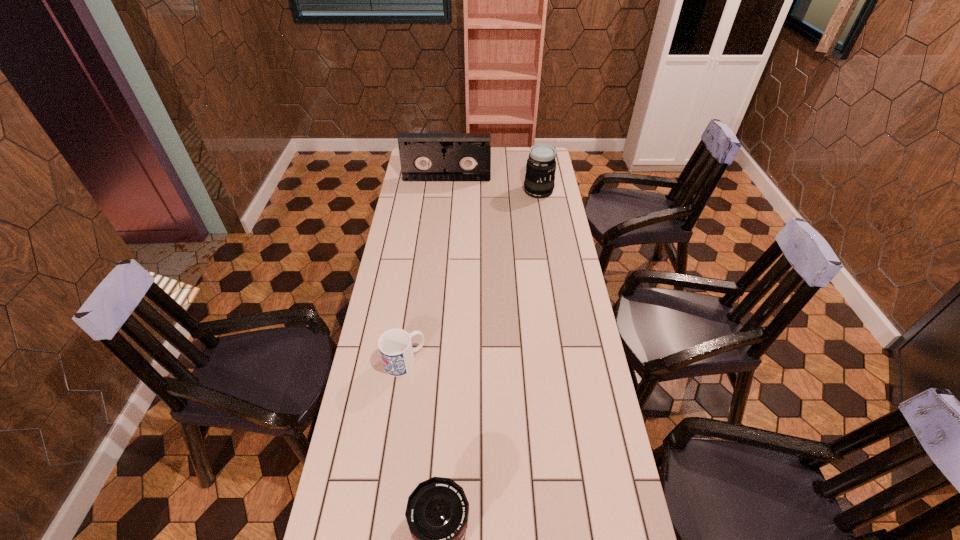
You are a GUI agent. You are given a task and a screenshot of the screen. Output one action in this format:
    pyautogui.click(x=<x>, y=<y>)
    Task: Click on the farthest object
    
    Given the screenshot: What is the action you would take?
    pyautogui.click(x=423, y=156)

At what (x,y) coordinates should I click in order to perform the action: click on the third nearest object. Please return your answer as a coordinate pair (x, y). Looking at the image, I should click on [x=539, y=181].

The width and height of the screenshot is (960, 540). I want to click on the right telephoto lens, so click(539, 181).

You are a GUI agent. You are given a task and a screenshot of the screen. Output one action in this format:
    pyautogui.click(x=<x>, y=<y>)
    Task: Click on the third farthest object
    This screenshot has width=960, height=540.
    Given the screenshot: What is the action you would take?
    point(395,346)

Identify the location of the shortest object. (395, 346).

You are a GUI agent. You are given a task and a screenshot of the screen. Output one action in this format:
    pyautogui.click(x=<x>, y=<y>)
    Task: Click on the vacant space situated on the front side of the videotape
    The width and height of the screenshot is (960, 540).
    Given the screenshot: What is the action you would take?
    pyautogui.click(x=443, y=225)

Identify the location of free space located on the left of the rightmost object. (474, 191).

In order to click on free location located on the right of the third farthest object in this screenshot , I will do `click(473, 361)`.

Identify the location of videotape that is at the left edge. The width and height of the screenshot is (960, 540). 423,156.

What are the coordinates of `mug located in the left edge section of the desktop` in the screenshot? It's located at (395, 346).